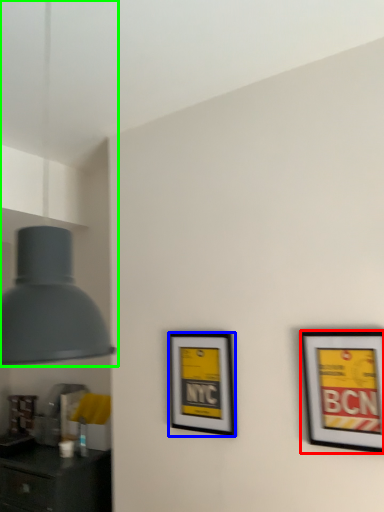
Question: Considering the real-world distances, which object is farthest from picture frame (highlighted by a red box)? picture frame (highlighted by a blue box) or lamp (highlighted by a green box)?

Choices:
 (A) picture frame
 (B) lamp

Answer: (B)